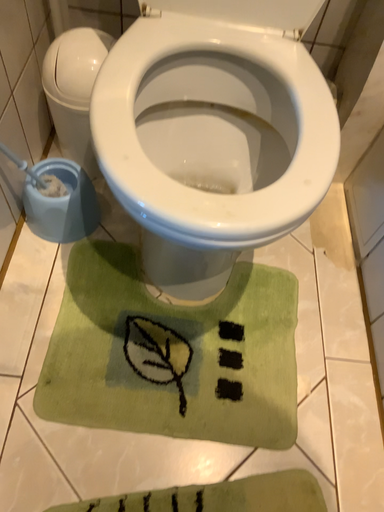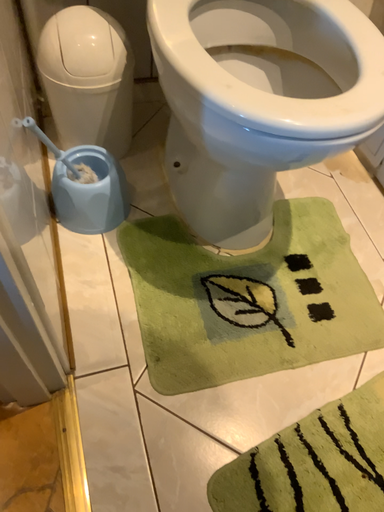
Question: Which way did the camera rotate in the video?

Choices:
 (A) rotated right
 (B) rotated left

Answer: (A)